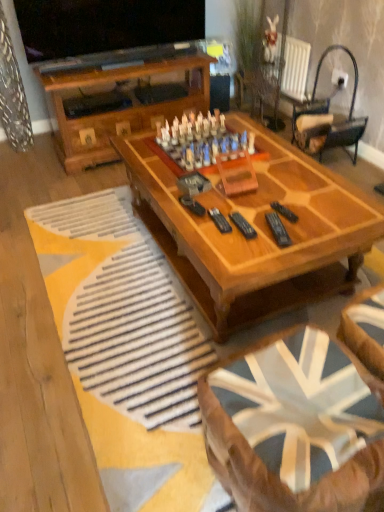
Where is `free spot to the right of black plastic remote at center, which is the 2th remote in left-to-right order`? This screenshot has width=384, height=512. free spot to the right of black plastic remote at center, which is the 2th remote in left-to-right order is located at coordinates (314, 228).